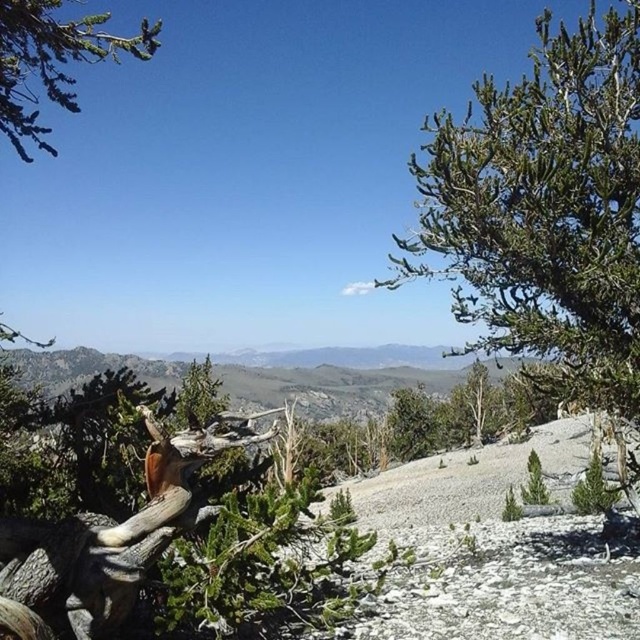
Identify the location of green needle-like at upper right. This screenshot has height=640, width=640. (545, 211).

Can you confirm if green needle-like at upper right is taller than green needle-like at upper left?

No, green needle-like at upper right is not taller than green needle-like at upper left.

The image size is (640, 640). Identify the location of green needle-like at upper right. (545, 211).

Identify the location of green needle-like at upper right. Image resolution: width=640 pixels, height=640 pixels. (545, 211).